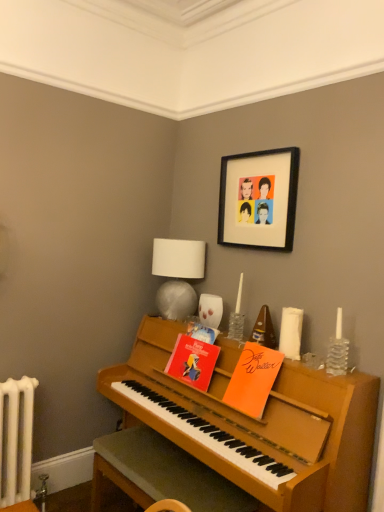
Question: Is white fabric lampshade at upper center not inside black matte picture frame at upper center?

Choices:
 (A) no
 (B) yes

Answer: (B)

Question: Does white fabric lampshade at upper center have a smaller size compared to black matte picture frame at upper center?

Choices:
 (A) no
 (B) yes

Answer: (A)

Question: Could you tell me if white fabric lampshade at upper center is facing black matte picture frame at upper center?

Choices:
 (A) yes
 (B) no

Answer: (B)

Question: Is white fabric lampshade at upper center not close to black matte picture frame at upper center?

Choices:
 (A) yes
 (B) no

Answer: (B)

Question: From a real-world perspective, is white fabric lampshade at upper center located higher than black matte picture frame at upper center?

Choices:
 (A) no
 (B) yes

Answer: (A)

Question: Considering the positions of black matte picture frame at upper center and clear glass candle at right in the image, is black matte picture frame at upper center wider or thinner than clear glass candle at right?

Choices:
 (A) thin
 (B) wide

Answer: (B)

Question: Looking at the image, does black matte picture frame at upper center seem bigger or smaller compared to clear glass candle at right?

Choices:
 (A) small
 (B) big

Answer: (B)

Question: In the image, is black matte picture frame at upper center on the left side or the right side of clear glass candle at right?

Choices:
 (A) left
 (B) right

Answer: (A)

Question: Relative to clear glass candle at right, is black matte picture frame at upper center in front or behind?

Choices:
 (A) behind
 (B) front

Answer: (A)

Question: In terms of size, does orange matte book at center, the third book viewed from the left, appear bigger or smaller than white fabric lampshade at upper center?

Choices:
 (A) small
 (B) big

Answer: (A)

Question: Is orange matte book at center, which is the first book in right-to-left order, to the left or to the right of white fabric lampshade at upper center in the image?

Choices:
 (A) left
 (B) right

Answer: (B)

Question: Considering the positions of point [251, 410] and point [201, 256], is point [251, 410] closer or farther from the camera than point [201, 256]?

Choices:
 (A) farther
 (B) closer

Answer: (B)

Question: From a real-world perspective, relative to white fabric lampshade at upper center, is orange matte book at center, which is the first book in right-to-left order, vertically above or below?

Choices:
 (A) below
 (B) above

Answer: (A)

Question: Is orange matte book at center, the third book viewed from the left, taller or shorter than red paper book at center, which is the 2th book in left-to-right order?

Choices:
 (A) tall
 (B) short

Answer: (A)

Question: Would you say orange matte book at center, which is the first book in right-to-left order, is to the left or to the right of red paper book at center, acting as the 2th book starting from the right, in the picture?

Choices:
 (A) left
 (B) right

Answer: (B)